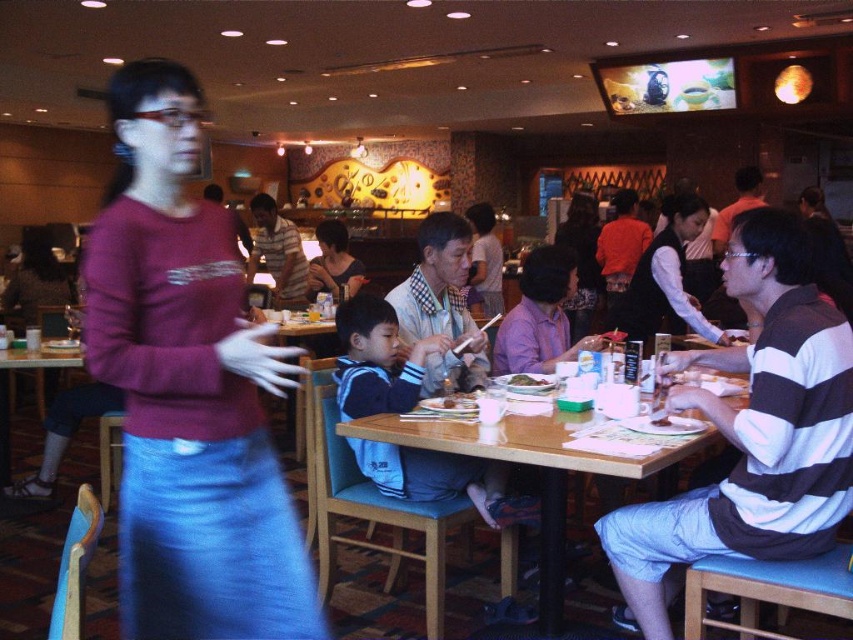
Find the location of `matte purple sweater at center`. matte purple sweater at center is located at coordinates (189, 390).

Can you confirm if matte purple sweater at center is positioned to the left of green matte rice at table center?

Indeed, matte purple sweater at center is positioned on the left side of green matte rice at table center.

Image resolution: width=853 pixels, height=640 pixels. In order to click on matte purple sweater at center in this screenshot , I will do `click(189, 390)`.

Is point (209, 580) more distant than point (300, 276)?

No, it is in front of (300, 276).

Is matte purple sweater at center below striped shirt at center?

Yes, matte purple sweater at center is below striped shirt at center.

The height and width of the screenshot is (640, 853). Identify the location of matte purple sweater at center. (189, 390).

Which is behind, point (503, 456) or point (332, 241)?

The point (332, 241) is behind.

Who is shorter, wooden table at center or matte black shirt at center?

matte black shirt at center is shorter.

Where is `wooden table at center`? Image resolution: width=853 pixels, height=640 pixels. wooden table at center is located at coordinates (537, 465).